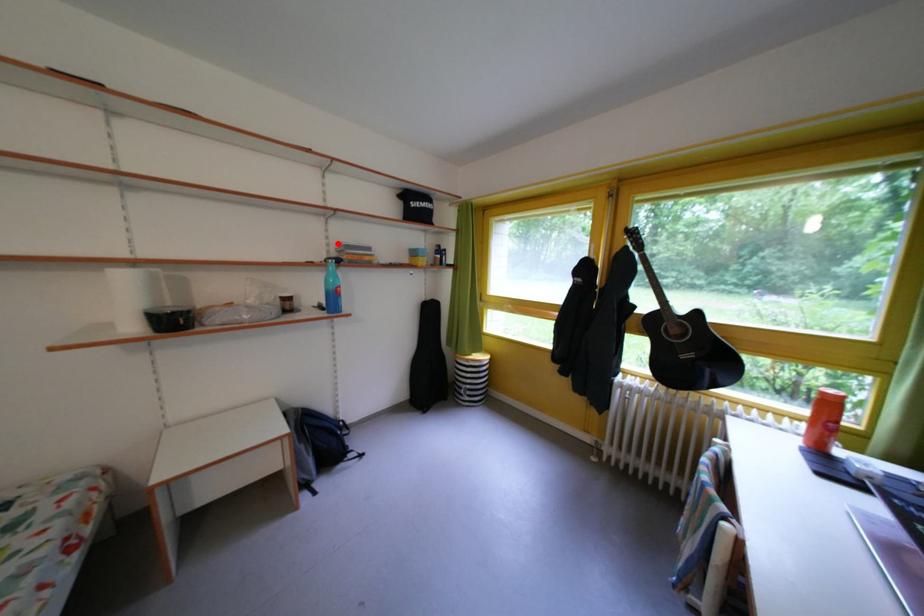
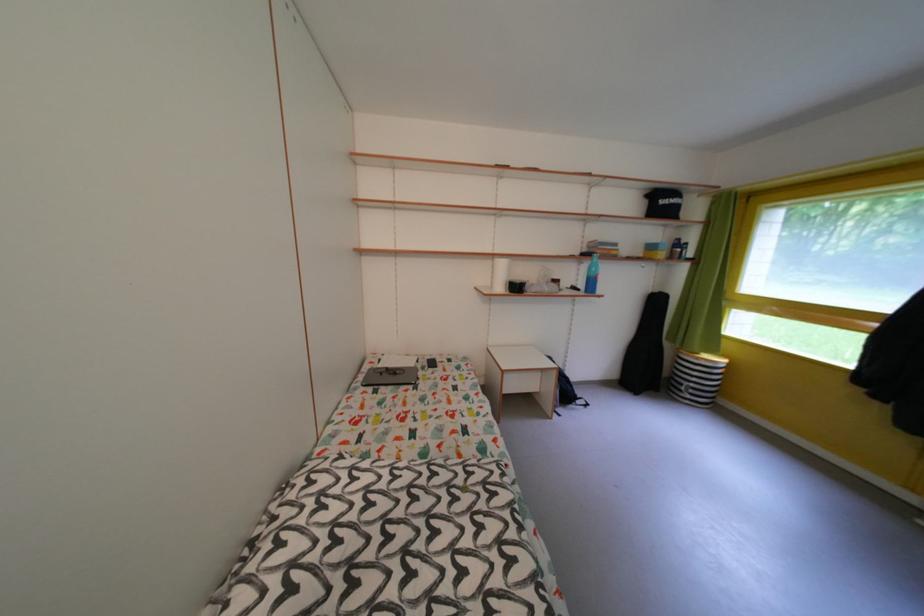
Locate, in the second image, the point that corresponds to the highlighted location in the first image.

(592, 243)